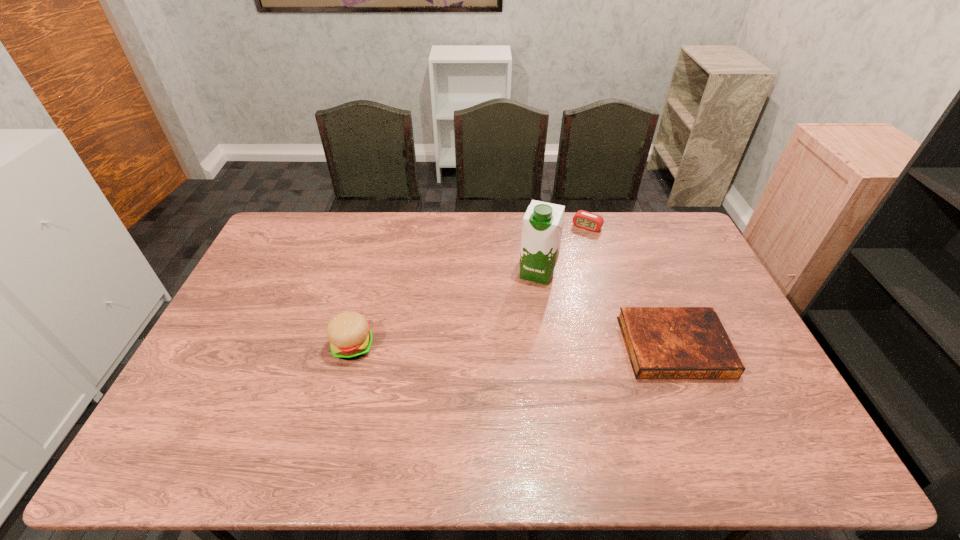
At what (x,y) coordinates should I click in order to perform the action: click on vacant area that lies between the farthest object and the third shortest object. Please return your answer as a coordinate pair (x, y). This screenshot has width=960, height=540. Looking at the image, I should click on (470, 287).

Where is `free space between the hamburger and the shortest object`? free space between the hamburger and the shortest object is located at coordinates (514, 347).

Locate an element on the screen. This screenshot has width=960, height=540. vacant area between the farthest object and the leftmost object is located at coordinates (470, 287).

Where is `empty space that is in between the soya milk and the Bible`? empty space that is in between the soya milk and the Bible is located at coordinates (606, 310).

I want to click on free space between the Bible and the alarm clock, so click(x=631, y=287).

In order to click on free space between the Bible and the third shortest object in this screenshot , I will do `click(514, 347)`.

Locate an element on the screen. free space between the hamburger and the Bible is located at coordinates (514, 347).

Find the location of a particular element. blank region between the second object from left to right and the second tallest object is located at coordinates coord(445,309).

Where is `vacant area that lies between the second object from left to right and the alarm clock`? This screenshot has width=960, height=540. vacant area that lies between the second object from left to right and the alarm clock is located at coordinates 563,250.

Locate an element on the screen. The width and height of the screenshot is (960, 540). vacant area between the Bible and the farthest object is located at coordinates 631,287.